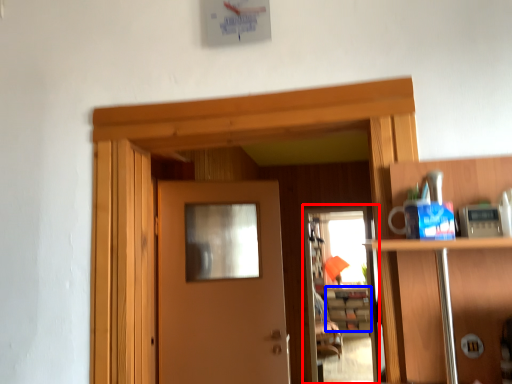
Question: Which point is further to the camera, screen door (highlighted by a red box) or cabinetry (highlighted by a blue box)?

Choices:
 (A) screen door
 (B) cabinetry

Answer: (B)